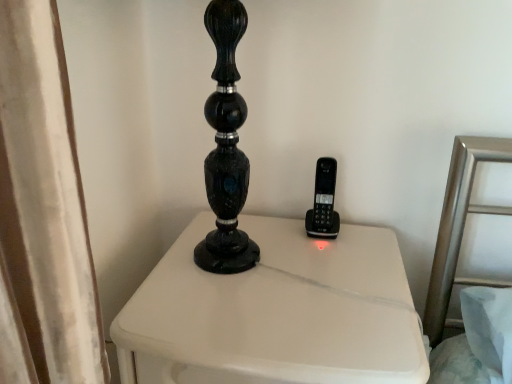
At what (x,y) coordinates should I click in order to perform the action: click on vacant point above white painted wood nightstand at center (from a real-world perspective). Please return your answer as a coordinate pair (x, y). The image size is (512, 384). Looking at the image, I should click on (275, 271).